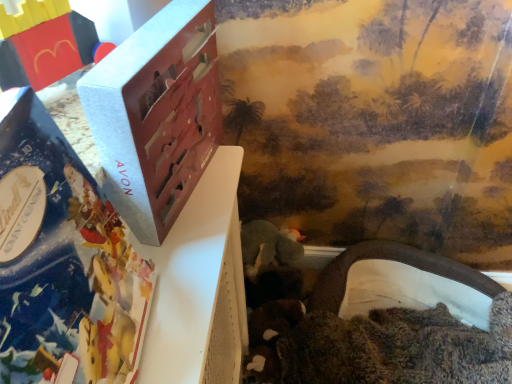
Question: Considering the positions of white fabric tunnel at lower right, which is the 1th toy from back to front, and brick-like plastic toy at upper left, arranged as the 2th toy when ordered from the bottom, in the image, is white fabric tunnel at lower right, which is the 1th toy from back to front, bigger or smaller than brick-like plastic toy at upper left, arranged as the 2th toy when ordered from the bottom,?

Choices:
 (A) small
 (B) big

Answer: (B)

Question: From the image's perspective, is white fabric tunnel at lower right, positioned as the 2th toy in top-to-bottom order, located above or below brick-like plastic toy at upper left, which is the 2th toy in right-to-left order?

Choices:
 (A) above
 (B) below

Answer: (B)

Question: Estimate the real-world distances between objects in this image. Which object is closer to the white fabric tunnel at lower right, acting as the second toy starting from the front?

Choices:
 (A) matte gray box at center
 (B) matte silver book at left
 (C) brick-like plastic toy at upper left, placed as the 1th toy when sorted from front to back

Answer: (A)

Question: Based on their relative distances, which object is nearer to the matte gray box at center?

Choices:
 (A) white fabric tunnel at lower right, positioned as the 2th toy in top-to-bottom order
 (B) matte silver book at left
 (C) brick-like plastic toy at upper left, placed as the 1th toy when sorted from front to back

Answer: (B)